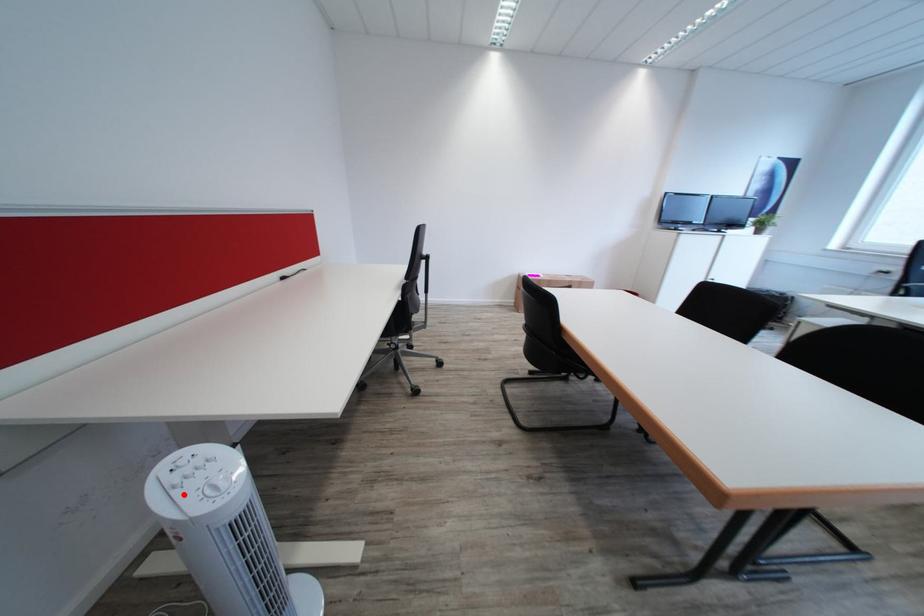
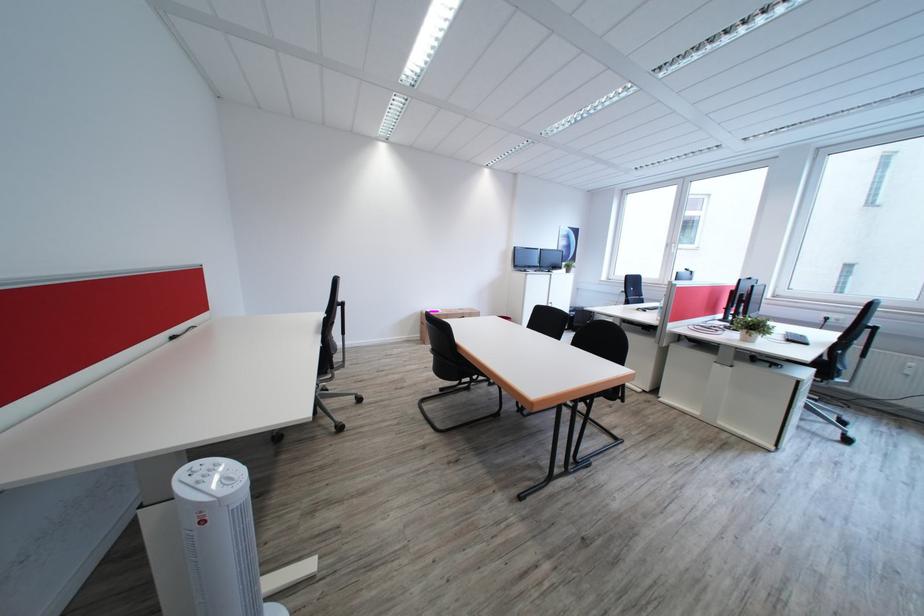
Locate, in the second image, the point that corresponds to the highlighted location in the first image.

(209, 488)